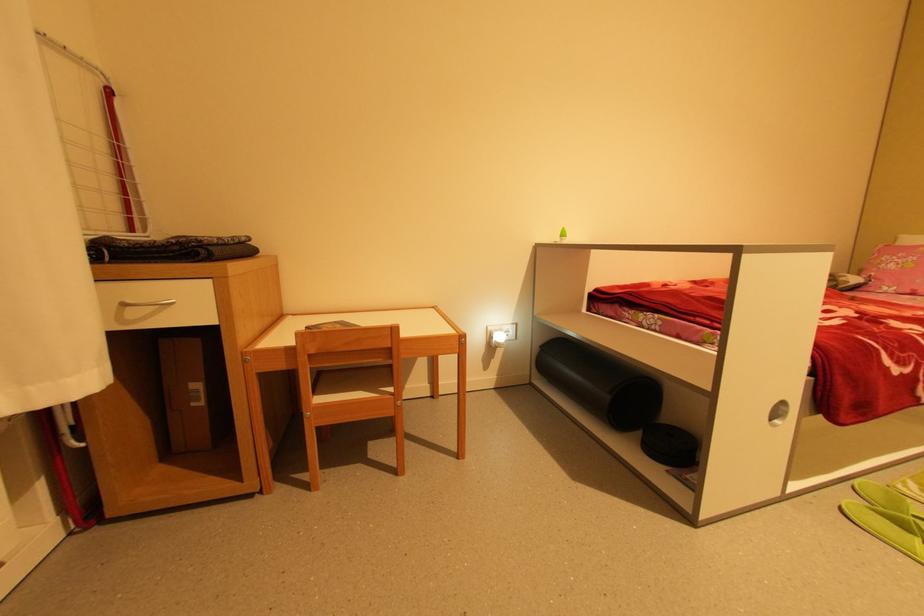
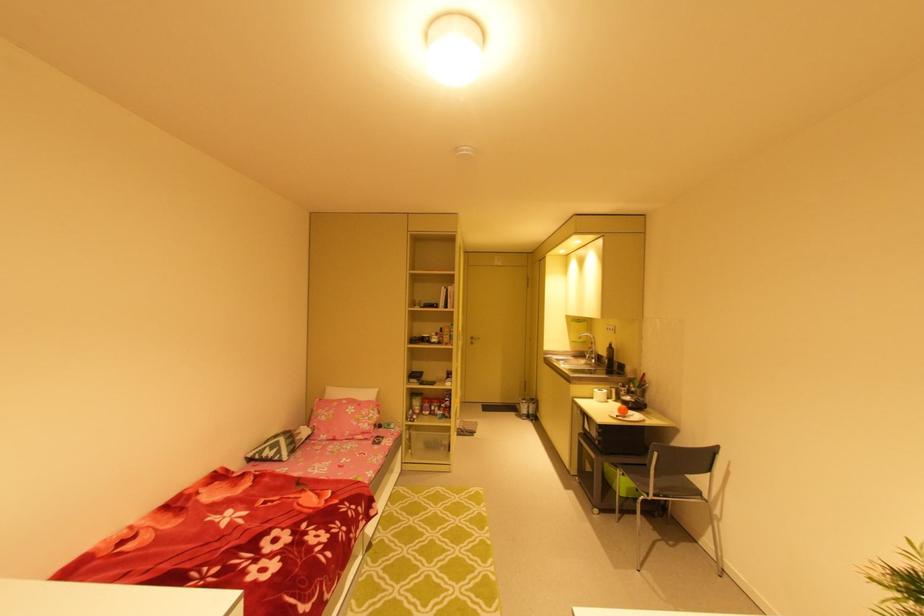
Question: How did the camera likely rotate?

Choices:
 (A) Left
 (B) Right
 (C) Up
 (D) Down

Answer: (B)